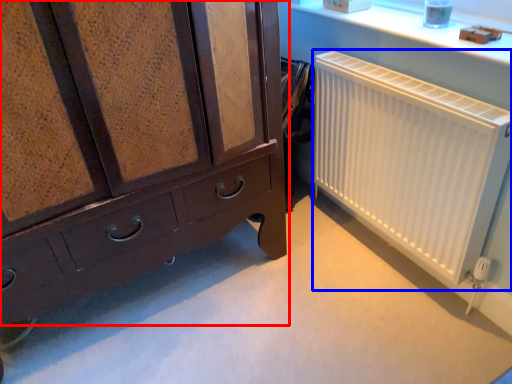
Question: Which of the following is the farthest to the observer, chest of drawers (highlighted by a red box) or radiator (highlighted by a blue box)?

Choices:
 (A) chest of drawers
 (B) radiator

Answer: (B)